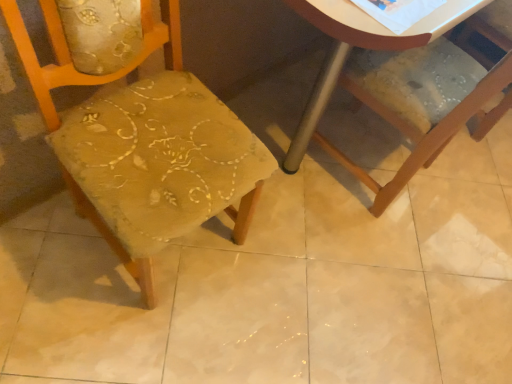
What do you see at coordinates (142, 136) in the screenshot?
I see `textured fabric chair at center, placed as the second chair when sorted from right to left` at bounding box center [142, 136].

Where is `textured fabric chair at center, placed as the second chair when sorted from right to left`? textured fabric chair at center, placed as the second chair when sorted from right to left is located at coordinates (142, 136).

In order to face textured fabric chair at center, positioned as the first chair in left-to-right order, should I rotate leftwards or rightwards?

You should look left and rotate roughly 13.252 degrees.

Where is `wooden chair at lower right, positioned as the 2th chair in left-to-right order`? This screenshot has width=512, height=384. wooden chair at lower right, positioned as the 2th chair in left-to-right order is located at coordinates (397, 83).

The image size is (512, 384). Describe the element at coordinates (397, 83) in the screenshot. I see `wooden chair at lower right, positioned as the 2th chair in left-to-right order` at that location.

Measure the distance between point (380, 201) and camera.

They are 1.46 meters apart.

The height and width of the screenshot is (384, 512). What are the coordinates of `textured fabric chair at center, positioned as the first chair in left-to-right order` in the screenshot? It's located at (142, 136).

Considering the positions of objects wooden chair at lower right, which is counted as the 1th chair, starting from the right, and textured fabric chair at center, placed as the second chair when sorted from right to left, in the image provided, who is more to the right, wooden chair at lower right, which is counted as the 1th chair, starting from the right, or textured fabric chair at center, placed as the second chair when sorted from right to left,?

wooden chair at lower right, which is counted as the 1th chair, starting from the right.

Does wooden chair at lower right, positioned as the 2th chair in left-to-right order, lie in front of textured fabric chair at center, placed as the second chair when sorted from right to left?

No.

Which point is more distant from viewer, (405, 166) or (98, 39)?

The point (405, 166) is behind.

From the image's perspective, which one is positioned higher, wooden chair at lower right, positioned as the 2th chair in left-to-right order, or textured fabric chair at center, placed as the second chair when sorted from right to left?

wooden chair at lower right, positioned as the 2th chair in left-to-right order, appears higher in the image.

From a real-world perspective, between wooden chair at lower right, positioned as the 2th chair in left-to-right order, and textured fabric chair at center, placed as the second chair when sorted from right to left, who is vertically higher?

In real-world perspective, textured fabric chair at center, placed as the second chair when sorted from right to left, is above.

Between wooden chair at lower right, which is counted as the 1th chair, starting from the right, and textured fabric chair at center, placed as the second chair when sorted from right to left, which one has larger width?

wooden chair at lower right, which is counted as the 1th chair, starting from the right.

Which of these two, wooden chair at lower right, which is counted as the 1th chair, starting from the right, or textured fabric chair at center, placed as the second chair when sorted from right to left, stands taller?

textured fabric chair at center, placed as the second chair when sorted from right to left.

Between wooden chair at lower right, which is counted as the 1th chair, starting from the right, and textured fabric chair at center, placed as the second chair when sorted from right to left, which one has smaller size?

With smaller size is wooden chair at lower right, which is counted as the 1th chair, starting from the right.

Does wooden chair at lower right, positioned as the 2th chair in left-to-right order, contain textured fabric chair at center, positioned as the first chair in left-to-right order?

No, textured fabric chair at center, positioned as the first chair in left-to-right order, is not inside wooden chair at lower right, positioned as the 2th chair in left-to-right order.

Is wooden chair at lower right, which is counted as the 1th chair, starting from the right, not near textured fabric chair at center, placed as the second chair when sorted from right to left?

wooden chair at lower right, which is counted as the 1th chair, starting from the right, is near textured fabric chair at center, placed as the second chair when sorted from right to left, not far away.

Is wooden chair at lower right, positioned as the 2th chair in left-to-right order, facing away from textured fabric chair at center, positioned as the first chair in left-to-right order?

No.

Locate an element on the screen. Image resolution: width=512 pixels, height=384 pixels. chair located in front of the wooden chair at lower right, which is counted as the 1th chair, starting from the right is located at coordinates (142, 136).

In the scene shown: Based on their positions, is textured fabric chair at center, positioned as the first chair in left-to-right order, located to the left or right of wooden chair at lower right, positioned as the 2th chair in left-to-right order?

In the image, textured fabric chair at center, positioned as the first chair in left-to-right order, appears on the left side of wooden chair at lower right, positioned as the 2th chair in left-to-right order.

Which object is more forward, textured fabric chair at center, placed as the second chair when sorted from right to left, or wooden chair at lower right, positioned as the 2th chair in left-to-right order?

textured fabric chair at center, placed as the second chair when sorted from right to left, is closer to the camera.

Which is farther, [94,74] or [329,8]?

Point [94,74]

From the image's perspective, is textured fabric chair at center, placed as the second chair when sorted from right to left, below wooden chair at lower right, which is counted as the 1th chair, starting from the right?

Correct, textured fabric chair at center, placed as the second chair when sorted from right to left, appears lower than wooden chair at lower right, which is counted as the 1th chair, starting from the right, in the image.

From a real-world perspective, relative to wooden chair at lower right, which is counted as the 1th chair, starting from the right, is textured fabric chair at center, placed as the second chair when sorted from right to left, vertically above or below?

Clearly, from a real-world perspective, textured fabric chair at center, placed as the second chair when sorted from right to left, is above wooden chair at lower right, which is counted as the 1th chair, starting from the right.

In the scene shown: Considering the relative sizes of textured fabric chair at center, placed as the second chair when sorted from right to left, and wooden chair at lower right, which is counted as the 1th chair, starting from the right, in the image provided, is textured fabric chair at center, placed as the second chair when sorted from right to left, wider than wooden chair at lower right, which is counted as the 1th chair, starting from the right,?

In fact, textured fabric chair at center, placed as the second chair when sorted from right to left, might be narrower than wooden chair at lower right, which is counted as the 1th chair, starting from the right.

Is textured fabric chair at center, placed as the second chair when sorted from right to left, taller or shorter than wooden chair at lower right, which is counted as the 1th chair, starting from the right?

In the image, textured fabric chair at center, placed as the second chair when sorted from right to left, appears to be taller than wooden chair at lower right, which is counted as the 1th chair, starting from the right.

Considering the sizes of objects textured fabric chair at center, positioned as the first chair in left-to-right order, and wooden chair at lower right, which is counted as the 1th chair, starting from the right, in the image provided, who is bigger, textured fabric chair at center, positioned as the first chair in left-to-right order, or wooden chair at lower right, which is counted as the 1th chair, starting from the right,?

textured fabric chair at center, positioned as the first chair in left-to-right order.

Which is correct: textured fabric chair at center, placed as the second chair when sorted from right to left, is inside wooden chair at lower right, which is counted as the 1th chair, starting from the right, or outside of it?

The correct answer is: outside.

Would you consider textured fabric chair at center, placed as the second chair when sorted from right to left, to be distant from wooden chair at lower right, positioned as the 2th chair in left-to-right order?

textured fabric chair at center, placed as the second chair when sorted from right to left, is actually quite close to wooden chair at lower right, positioned as the 2th chair in left-to-right order.

Is textured fabric chair at center, positioned as the first chair in left-to-right order, oriented away from wooden chair at lower right, which is counted as the 1th chair, starting from the right?

textured fabric chair at center, positioned as the first chair in left-to-right order, does not have its back to wooden chair at lower right, which is counted as the 1th chair, starting from the right.

Locate an element on the screen. The image size is (512, 384). chair that appears above the textured fabric chair at center, positioned as the first chair in left-to-right order (from the image's perspective) is located at coordinates [397, 83].

The image size is (512, 384). In order to click on chair located below the wooden chair at lower right, which is counted as the 1th chair, starting from the right (from the image's perspective) in this screenshot , I will do `click(142, 136)`.

Where is `chair behind the textured fabric chair at center, positioned as the first chair in left-to-right order`? chair behind the textured fabric chair at center, positioned as the first chair in left-to-right order is located at coordinates (397, 83).